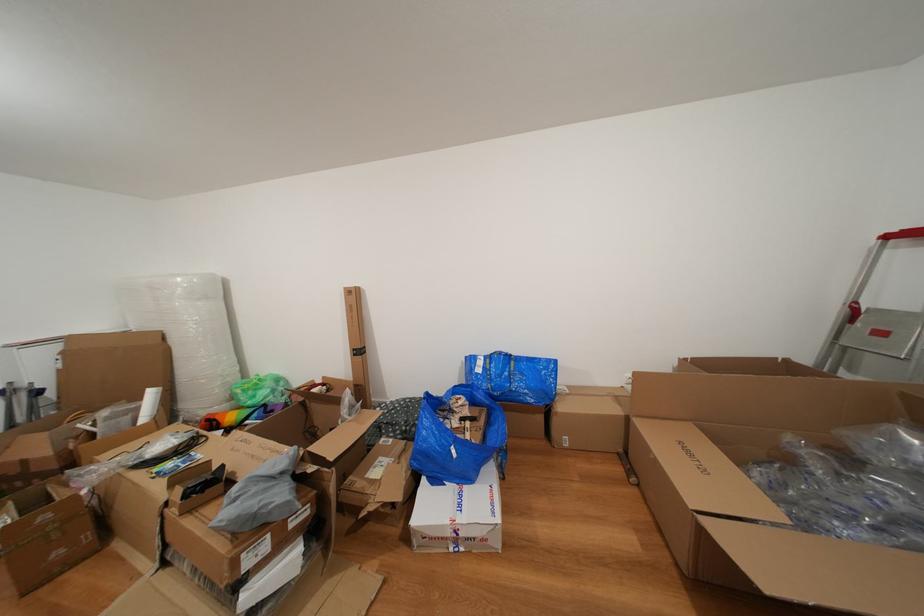
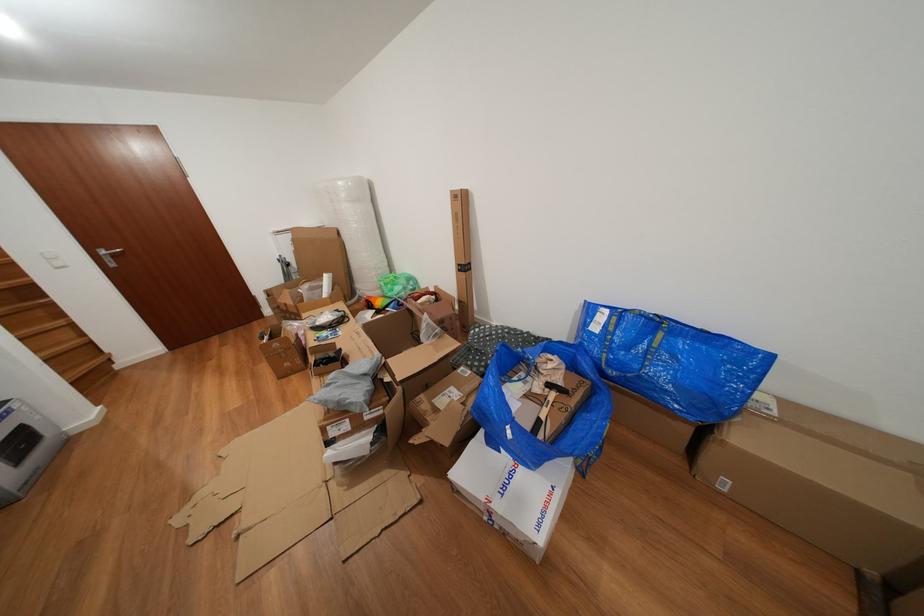
Where in the second image is the point corresponding to point 561,406 from the first image?

(734, 424)